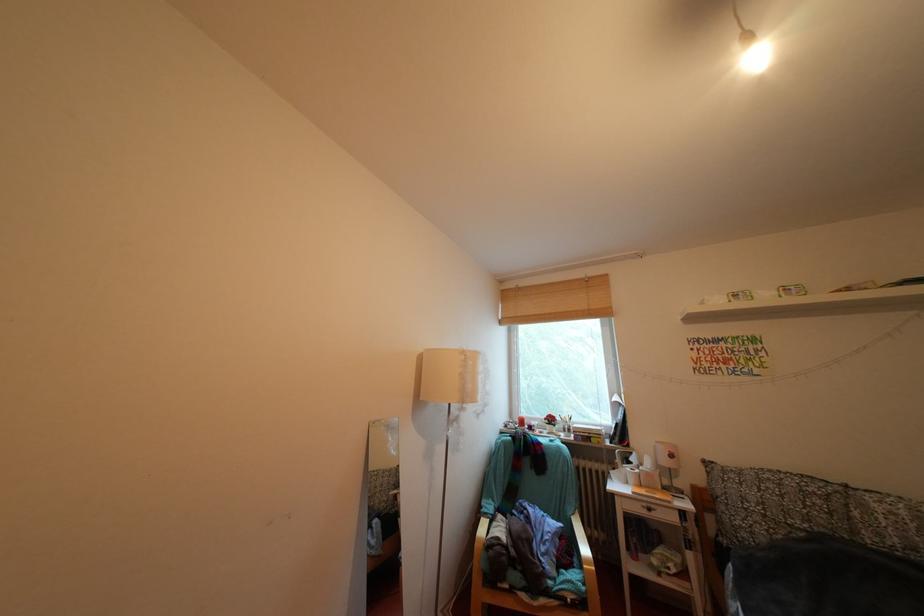
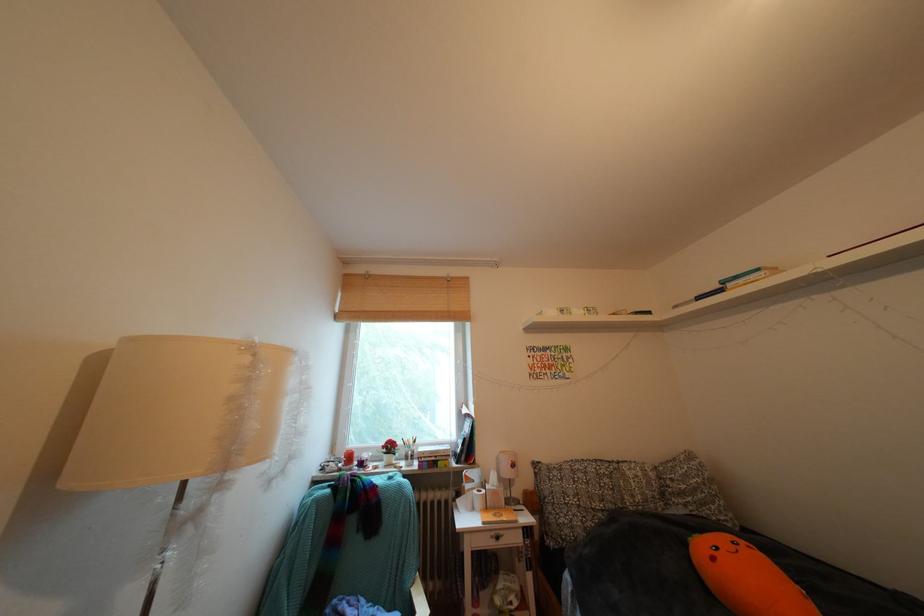
The point at (x=625, y=439) is marked in the first image. Where is the corresponding point in the second image?

(472, 456)